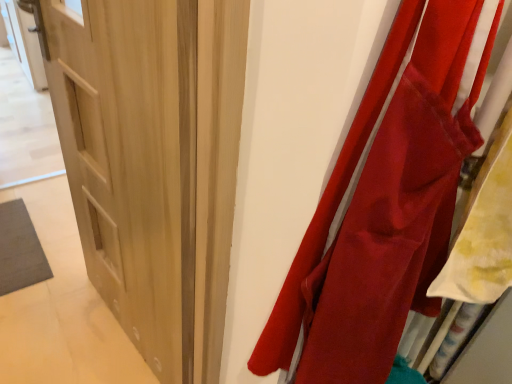
Locate an element on the screen. The image size is (512, 384). light wood door at center is located at coordinates (132, 161).

Image resolution: width=512 pixels, height=384 pixels. What do you see at coordinates (132, 161) in the screenshot?
I see `light wood door at center` at bounding box center [132, 161].

What is the approximate height of light wood door at center?

It is 4.20 feet.

Measure the distance between point (86,261) and camera.

Point (86,261) is 1.67 meters from camera.

I want to click on matte red fabric at right, so click(x=384, y=206).

This screenshot has width=512, height=384. What do you see at coordinates (384, 206) in the screenshot?
I see `matte red fabric at right` at bounding box center [384, 206].

Measure the distance between matte red fabric at right and camera.

They are 41.60 centimeters apart.

The width and height of the screenshot is (512, 384). In order to click on light wood door at center in this screenshot , I will do `click(132, 161)`.

In the scene shown: Considering the positions of objects light wood door at center and matte red fabric at right in the image provided, who is more to the right, light wood door at center or matte red fabric at right?

matte red fabric at right.

Is light wood door at center closer to the viewer compared to matte red fabric at right?

No, it is behind matte red fabric at right.

Which is behind, point (108, 85) or point (329, 196)?

The point (108, 85) is farther from the camera.

From the image's perspective, is light wood door at center under matte red fabric at right?

Actually, light wood door at center appears above matte red fabric at right in the image.

From a real-world perspective, who is located lower, light wood door at center or matte red fabric at right?

light wood door at center.

Considering the relative sizes of light wood door at center and matte red fabric at right in the image provided, is light wood door at center wider than matte red fabric at right?

Incorrect, the width of light wood door at center does not surpass that of matte red fabric at right.

Does light wood door at center have a lesser height compared to matte red fabric at right?

In fact, light wood door at center may be taller than matte red fabric at right.

Considering the sizes of objects light wood door at center and matte red fabric at right in the image provided, who is smaller, light wood door at center or matte red fabric at right?

With smaller size is matte red fabric at right.

Is light wood door at center not inside matte red fabric at right?

Yes, light wood door at center is not within matte red fabric at right.

From the picture: Is light wood door at center positioned far away from matte red fabric at right?

light wood door at center is actually quite close to matte red fabric at right.

Is light wood door at center facing away from matte red fabric at right?

No.

What's the angular difference between light wood door at center and matte red fabric at right's facing directions?

76.5 degrees.

You are a GUI agent. You are given a task and a screenshot of the screen. Output one action in this format:
    pyautogui.click(x=<x>, y=<y>)
    Task: Click on the curtain above the light wood door at center (from a real-world perspective)
    This screenshot has height=384, width=512.
    Given the screenshot: What is the action you would take?
    pyautogui.click(x=384, y=206)

Would you say matte red fabric at right is to the left or to the right of light wood door at center in the picture?

Based on their positions, matte red fabric at right is located to the right of light wood door at center.

Considering the relative positions of matte red fabric at right and light wood door at center in the image provided, is matte red fabric at right behind light wood door at center?

No, it is not.

Which point is more forward, (344, 346) or (188, 254)?

The point (344, 346) is closer to the camera.

From the image's perspective, is matte red fabric at right located above or below light wood door at center?

From the image's perspective, matte red fabric at right appears below light wood door at center.

From a real-world perspective, is matte red fabric at right located beneath light wood door at center?

No, from a real-world perspective, matte red fabric at right is not below light wood door at center.

Which object is wider, matte red fabric at right or light wood door at center?

Wider between the two is matte red fabric at right.

Is matte red fabric at right taller or shorter than light wood door at center?

In the image, matte red fabric at right appears to be shorter than light wood door at center.

Based on their sizes in the image, would you say matte red fabric at right is bigger or smaller than light wood door at center?

matte red fabric at right is smaller than light wood door at center.

Which is correct: matte red fabric at right is inside light wood door at center, or outside of it?

matte red fabric at right cannot be found inside light wood door at center.

Is matte red fabric at right positioned far away from light wood door at center?

That's not correct — matte red fabric at right is a little close to light wood door at center.

Does matte red fabric at right turn towards light wood door at center?

No, matte red fabric at right does not turn towards light wood door at center.

Can you tell me how much matte red fabric at right and light wood door at center differ in facing direction?

There is a 76.5-degree angle between the facing directions of matte red fabric at right and light wood door at center.

Image resolution: width=512 pixels, height=384 pixels. I want to click on door that is behind the matte red fabric at right, so click(x=132, y=161).

Image resolution: width=512 pixels, height=384 pixels. In order to click on door behind the matte red fabric at right in this screenshot , I will do `click(132, 161)`.

Where is `curtain that is on the right side of light wood door at center`? The height and width of the screenshot is (384, 512). curtain that is on the right side of light wood door at center is located at coordinates (384, 206).